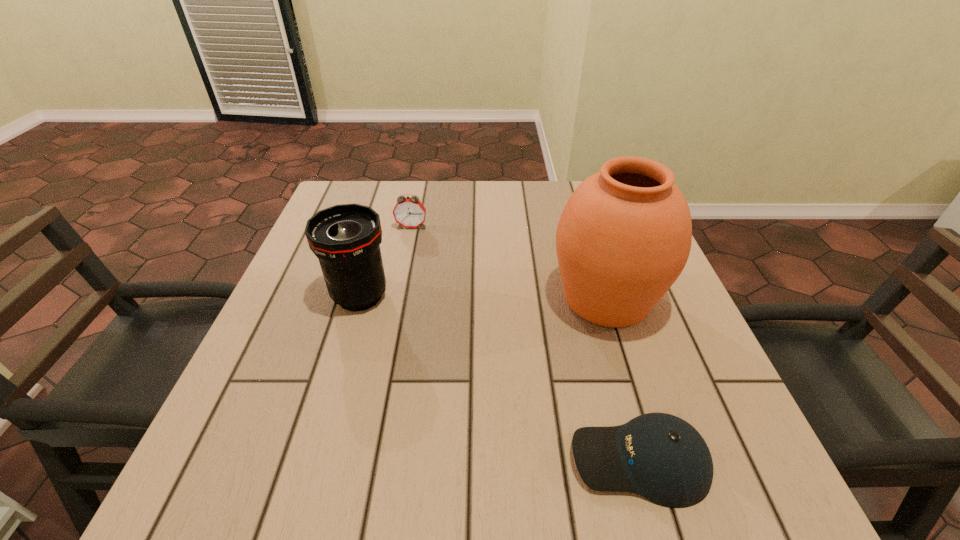
Identify the location of free space located on the front-facing side of the baseball cap. (332, 461).

Find the location of a particular element. free space located 0.110m on the front-facing side of the baseball cap is located at coordinates (497, 461).

You are a GUI agent. You are given a task and a screenshot of the screen. Output one action in this format:
    pyautogui.click(x=<x>, y=<y>)
    Task: Click on the object located in the far edge section of the desktop
    
    Given the screenshot: What is the action you would take?
    pyautogui.click(x=408, y=212)

Identify the location of object present at the near edge. This screenshot has width=960, height=540. (659, 456).

Locate an element on the screen. This screenshot has width=960, height=540. object that is at the left edge is located at coordinates click(x=346, y=238).

The image size is (960, 540). Identify the location of urn present at the right edge. (624, 237).

This screenshot has width=960, height=540. I want to click on baseball cap that is at the right edge, so click(659, 456).

At what (x,y) coordinates should I click in order to perform the action: click on object that is at the near right corner. Please return your answer as a coordinate pair (x, y). Image resolution: width=960 pixels, height=540 pixels. Looking at the image, I should click on (659, 456).

Image resolution: width=960 pixels, height=540 pixels. In the image, there is a desktop. In order to click on vacant space at the far edge in this screenshot , I will do `click(395, 202)`.

Locate an element on the screen. vacant position at the left edge of the desktop is located at coordinates (319, 321).